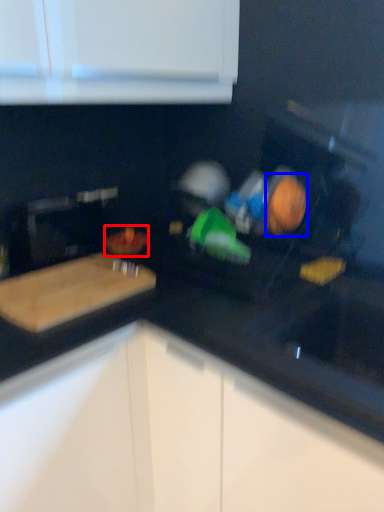
Question: Which object is further to the camera taking this photo, food (highlighted by a red box) or food (highlighted by a blue box)?

Choices:
 (A) food
 (B) food

Answer: (A)